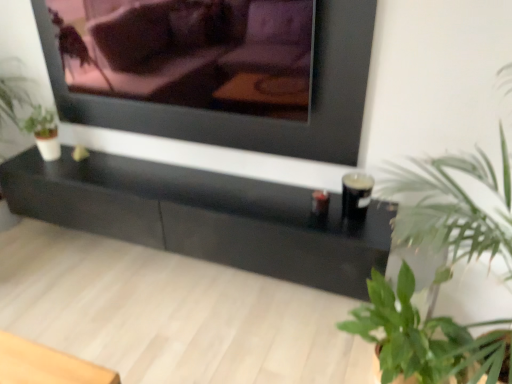
Question: In terms of size, does black glossy table at center appear bigger or smaller than matte black frame at upper center?

Choices:
 (A) big
 (B) small

Answer: (A)

Question: From a real-world perspective, is black glossy table at center above or below matte black frame at upper center?

Choices:
 (A) below
 (B) above

Answer: (A)

Question: Estimate the real-world distances between objects in this image. Which object is farther from the green leafy plant at right, acting as the 2th houseplant starting from the bottom?

Choices:
 (A) matte black frame at upper center
 (B) matte black couch at upper center
 (C) green leafy plant at lower right, which is the 2th houseplant in top-to-bottom order
 (D) black glossy table at center

Answer: (B)

Question: Based on their relative distances, which object is nearer to the matte black couch at upper center?

Choices:
 (A) green leafy plant at right, the 1th houseplant from the top
 (B) green leafy plant at lower right, positioned as the 1th houseplant in bottom-to-top order
 (C) matte black frame at upper center
 (D) black glossy table at center

Answer: (D)